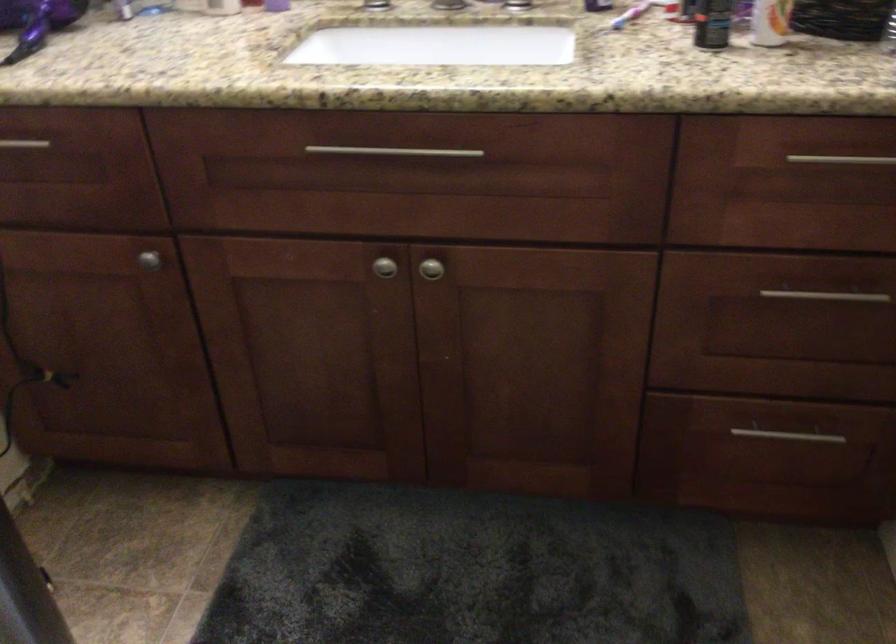
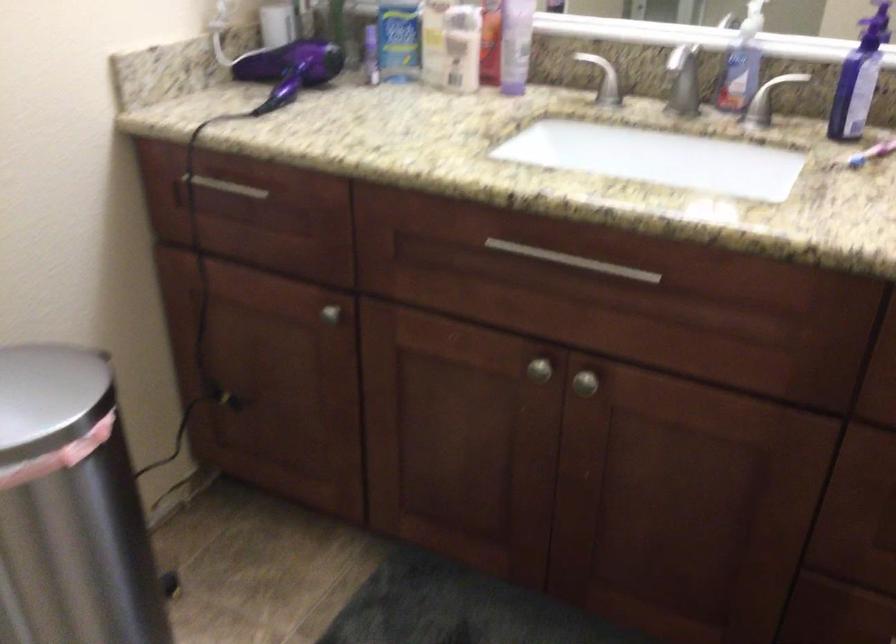
Question: The camera is either moving clockwise (left) or counter-clockwise (right) around the object. The first image is from the beginning of the video and the second image is from the end. Is the camera moving left or right when shooting the video?

Choices:
 (A) Left
 (B) Right

Answer: (B)